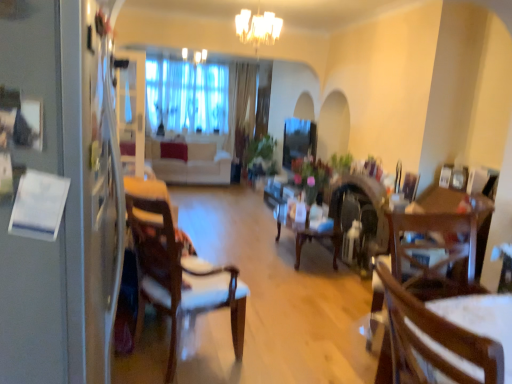
Question: Is white glossy fridge at left a part of wooden table at center?

Choices:
 (A) no
 (B) yes

Answer: (A)

Question: Can you confirm if wooden table at center is taller than white glossy fridge at left?

Choices:
 (A) no
 (B) yes

Answer: (A)

Question: From a real-world perspective, is wooden table at center beneath white glossy fridge at left?

Choices:
 (A) yes
 (B) no

Answer: (A)

Question: Does wooden table at center have a smaller size compared to white glossy fridge at left?

Choices:
 (A) no
 (B) yes

Answer: (B)

Question: Is wooden table at center not inside white glossy fridge at left?

Choices:
 (A) yes
 (B) no

Answer: (A)

Question: Is wooden chair at right, placed as the third chair when sorted from front to back, inside the boundaries of transparent glass window screen at center, or outside?

Choices:
 (A) outside
 (B) inside

Answer: (A)

Question: Based on their positions, is wooden chair at right, the first chair positioned from the right, located to the left or right of transparent glass window screen at center?

Choices:
 (A) right
 (B) left

Answer: (A)

Question: Is wooden chair at right, the 1th chair positioned from the back, bigger or smaller than transparent glass window screen at center?

Choices:
 (A) small
 (B) big

Answer: (B)

Question: From the image's perspective, is wooden chair at right, the first chair positioned from the right, above or below transparent glass window screen at center?

Choices:
 (A) above
 (B) below

Answer: (B)

Question: Is white fabric chair at left, the first chair positioned from the left, taller or shorter than wooden table at center?

Choices:
 (A) short
 (B) tall

Answer: (B)

Question: Is white fabric chair at left, which ranks as the 2th chair in back-to-front order, situated inside wooden table at center or outside?

Choices:
 (A) inside
 (B) outside

Answer: (B)

Question: Would you say white fabric chair at left, marked as the third chair in a right-to-left arrangement, is to the left or to the right of wooden table at center in the picture?

Choices:
 (A) left
 (B) right

Answer: (A)

Question: From the image's perspective, relative to wooden table at center, is white fabric chair at left, which ranks as the 2th chair in back-to-front order, above or below?

Choices:
 (A) above
 (B) below

Answer: (B)

Question: Which is correct: wooden chair at center, which is the 2th chair from right to left, is inside white fabric chair at left, marked as the third chair in a right-to-left arrangement, or outside of it?

Choices:
 (A) outside
 (B) inside

Answer: (A)

Question: Is wooden chair at center, which is the 3th chair from back to front, wider or thinner than white fabric chair at left, which ranks as the 2th chair in back-to-front order?

Choices:
 (A) wide
 (B) thin

Answer: (B)